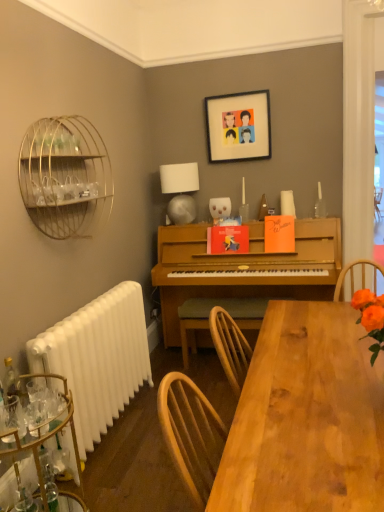
Question: Can you confirm if gold wire birdcage at left is positioned to the left of white plastic radiator at lower left?

Choices:
 (A) no
 (B) yes

Answer: (B)

Question: Is gold wire birdcage at left located outside white plastic radiator at lower left?

Choices:
 (A) yes
 (B) no

Answer: (A)

Question: Is gold wire birdcage at left beside white plastic radiator at lower left?

Choices:
 (A) no
 (B) yes

Answer: (A)

Question: Is white plastic radiator at lower left surrounded by gold wire birdcage at left?

Choices:
 (A) no
 (B) yes

Answer: (A)

Question: Is the depth of gold wire birdcage at left greater than that of white plastic radiator at lower left?

Choices:
 (A) yes
 (B) no

Answer: (B)

Question: Is gold wire birdcage at left not near white plastic radiator at lower left?

Choices:
 (A) yes
 (B) no

Answer: (B)

Question: Is wooden table at lower center smaller than gold wire birdcage at left?

Choices:
 (A) yes
 (B) no

Answer: (B)

Question: Is wooden table at lower center turned away from gold wire birdcage at left?

Choices:
 (A) yes
 (B) no

Answer: (B)

Question: Is gold wire birdcage at left located within wooden table at lower center?

Choices:
 (A) no
 (B) yes

Answer: (A)

Question: Is wooden table at lower center positioned before gold wire birdcage at left?

Choices:
 (A) no
 (B) yes

Answer: (B)

Question: Is wooden table at lower center positioned behind gold wire birdcage at left?

Choices:
 (A) yes
 (B) no

Answer: (B)

Question: Considering the relative sizes of wooden table at lower center and gold wire birdcage at left in the image provided, is wooden table at lower center shorter than gold wire birdcage at left?

Choices:
 (A) no
 (B) yes

Answer: (B)

Question: Does wooden chair at center lie in front of metallic gold bar cart at lower left?

Choices:
 (A) yes
 (B) no

Answer: (B)